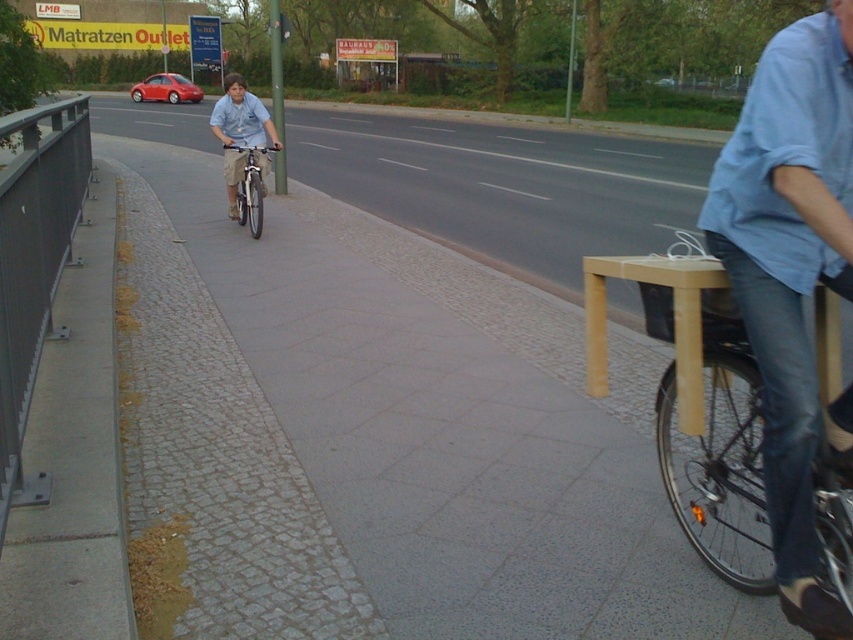
Which is above, blue denim jeans at center or dark gray metal rail at left?

dark gray metal rail at left

Can you confirm if blue denim jeans at center is positioned above dark gray metal rail at left?

No.

Is point (827, 237) positioned before point (86, 99)?

That is True.

Locate an element on the screen. The height and width of the screenshot is (640, 853). blue denim jeans at center is located at coordinates (790, 268).

Between blue denim jeans at center and silver metallic bicycle at center-left, which one appears on the left side from the viewer's perspective?

silver metallic bicycle at center-left

Describe the element at coordinates (790, 268) in the screenshot. I see `blue denim jeans at center` at that location.

Locate an element on the screen. The image size is (853, 640). blue denim jeans at center is located at coordinates (790, 268).

Which is behind, point (15, 208) or point (247, 196)?

The point (247, 196) is behind.

Does point (51, 177) come farther from viewer compared to point (254, 147)?

No, it is not.

Is point (45, 113) in front of point (244, 161)?

Yes.

Identify the location of dark gray metal rail at left. (33, 259).